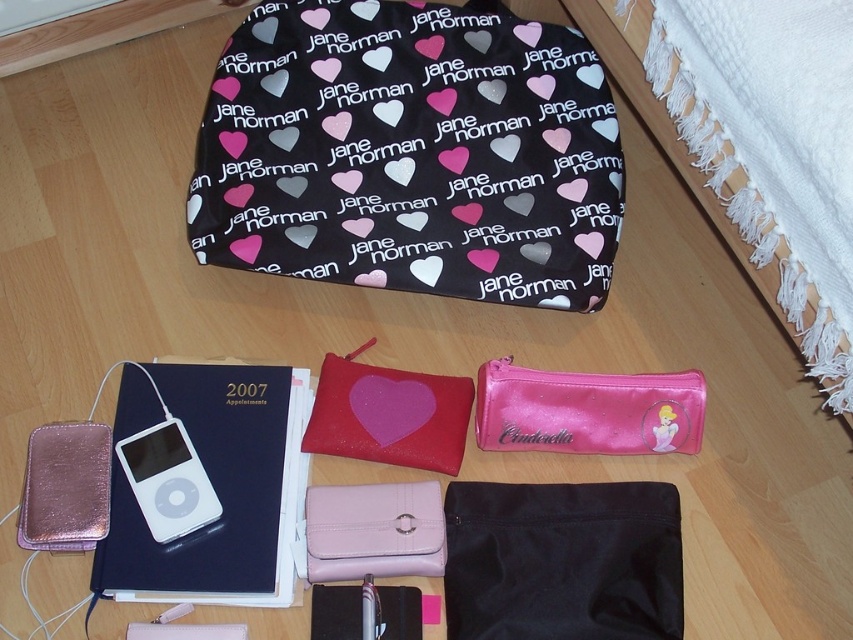
Can you confirm if black fabric bag at upper center is positioned to the left of pink glittery heart at center?

Answer: Incorrect, black fabric bag at upper center is not on the left side of pink glittery heart at center.

Between black fabric bag at upper center and pink glittery heart at center, which one has more height?

black fabric bag at upper center

I want to click on black fabric bag at upper center, so click(410, 152).

Is pink fabric bed at lower right wider than pink glittery heart at center?

Indeed, pink fabric bed at lower right has a greater width compared to pink glittery heart at center.

Does point (714, 49) come closer to viewer compared to point (410, 412)?

Yes, point (714, 49) is in front of point (410, 412).

Identify the location of pink fabric bed at lower right. This screenshot has height=640, width=853. (769, 145).

Can you confirm if black fabric bag at upper center is positioned to the right of white glossy ipod at bottom left?

Correct, you'll find black fabric bag at upper center to the right of white glossy ipod at bottom left.

Who is higher up, black fabric bag at upper center or white glossy ipod at bottom left?

Positioned higher is black fabric bag at upper center.

What do you see at coordinates (410, 152) in the screenshot? I see `black fabric bag at upper center` at bounding box center [410, 152].

Image resolution: width=853 pixels, height=640 pixels. I want to click on black fabric bag at upper center, so click(410, 152).